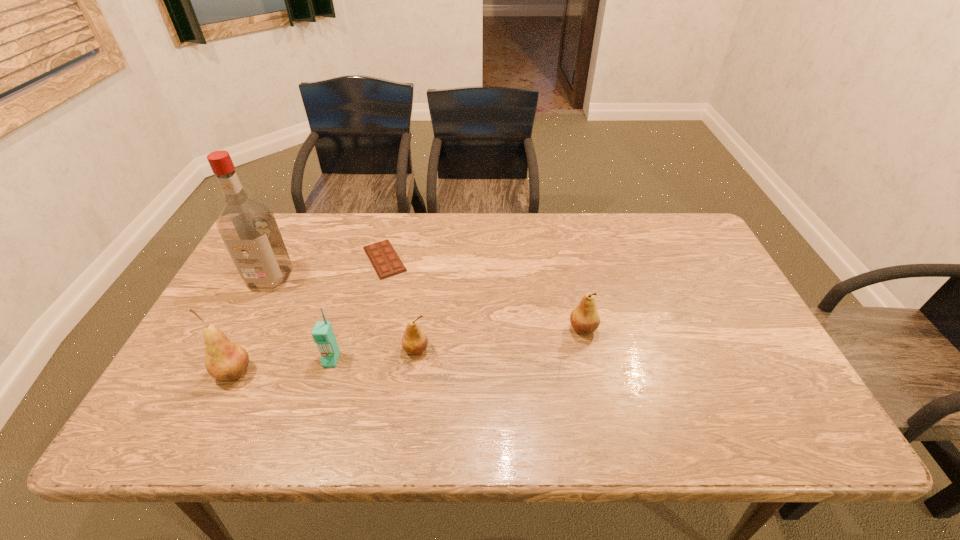
What are the coordinates of `free space between the chocolate bar and the rightmost pear` in the screenshot? It's located at (484, 294).

The width and height of the screenshot is (960, 540). I want to click on free space between the shortest object and the liquor, so click(x=327, y=268).

I want to click on free space that is in between the liquor and the leftmost pear, so click(252, 325).

Select which object is the closest to the chocolate bar. Please provide its 2D coordinates. Your answer should be formatted as a tuple, i.e. [(x, y)], where the tuple contains the x and y coordinates of a point satisfying the conditions above.

[(248, 228)]

This screenshot has width=960, height=540. In order to click on the fourth closest object to the tallest object in this screenshot , I will do `click(414, 341)`.

Locate which pear ranks second in proximity to the shortest object. Please provide its 2D coordinates. Your answer should be formatted as a tuple, i.e. [(x, y)], where the tuple contains the x and y coordinates of a point satisfying the conditions above.

[(224, 360)]

Locate which pear is the second closest to the leftmost pear. Please provide its 2D coordinates. Your answer should be formatted as a tuple, i.e. [(x, y)], where the tuple contains the x and y coordinates of a point satisfying the conditions above.

[(584, 318)]

Where is `blank area in the image that satisfies the following two spatial constraints: 1. on the front-facing side of the liquor; 2. on the right side of the leftmost pear`? blank area in the image that satisfies the following two spatial constraints: 1. on the front-facing side of the liquor; 2. on the right side of the leftmost pear is located at coordinates (x=222, y=372).

Image resolution: width=960 pixels, height=540 pixels. Find the location of `vacant position in the image that satisfies the following two spatial constraints: 1. on the front-facing side of the tallest object; 2. on the right side of the second pear from right to left`. vacant position in the image that satisfies the following two spatial constraints: 1. on the front-facing side of the tallest object; 2. on the right side of the second pear from right to left is located at coordinates (233, 349).